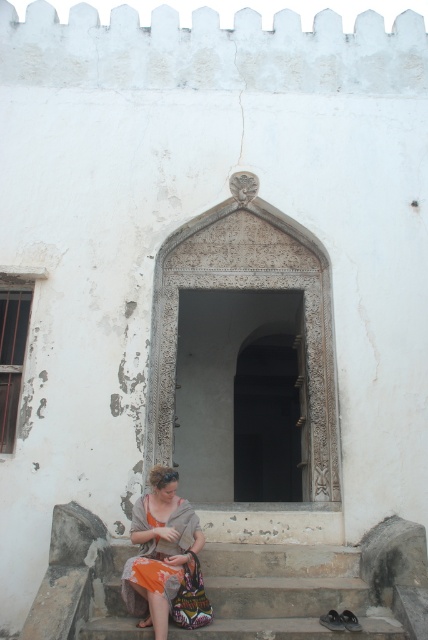
Is smooth stone stairs at lower center positioned at the back of orange fabric at lower left?

Yes, smooth stone stairs at lower center is further from the viewer.

Can you confirm if smooth stone stairs at lower center is shorter than orange fabric at lower left?

Yes.

Which is in front, point (243, 579) or point (165, 509)?

Point (165, 509) is more forward.

Where is `smooth stone stairs at lower center`? The width and height of the screenshot is (428, 640). smooth stone stairs at lower center is located at coordinates (285, 593).